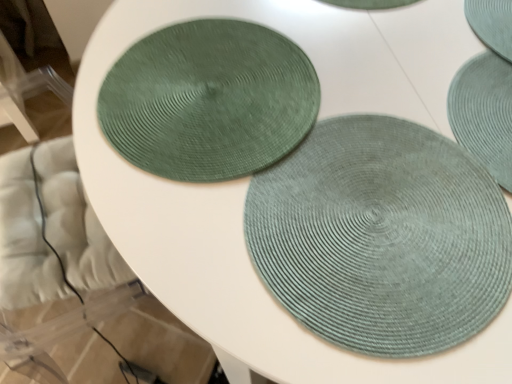
Find the location of `vacant space to the right of green woven coaster at upper left, arranged as the 2th coaster when viewed from the right`. vacant space to the right of green woven coaster at upper left, arranged as the 2th coaster when viewed from the right is located at coordinates (408, 102).